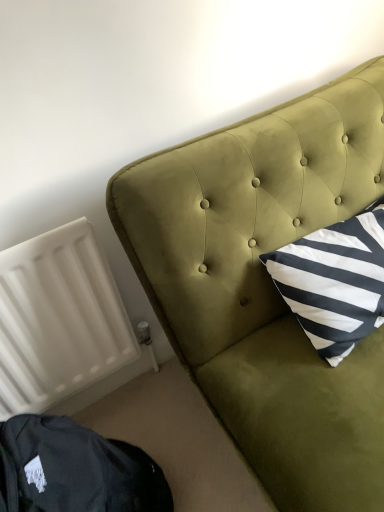
Question: Is dark green velvet bean bag chair at lower left taller than white matte radiator at lower left?

Choices:
 (A) yes
 (B) no

Answer: (B)

Question: Is white matte radiator at lower left surrounded by dark green velvet bean bag chair at lower left?

Choices:
 (A) no
 (B) yes

Answer: (A)

Question: Is dark green velvet bean bag chair at lower left at the right side of white matte radiator at lower left?

Choices:
 (A) no
 (B) yes

Answer: (B)

Question: From a real-world perspective, is dark green velvet bean bag chair at lower left on top of white matte radiator at lower left?

Choices:
 (A) yes
 (B) no

Answer: (B)

Question: From a real-world perspective, does dark green velvet bean bag chair at lower left sit lower than white matte radiator at lower left?

Choices:
 (A) no
 (B) yes

Answer: (B)

Question: Considering the positions of point pos(112,288) and point pos(29,461), is point pos(112,288) closer or farther from the camera than point pos(29,461)?

Choices:
 (A) closer
 (B) farther

Answer: (B)

Question: From a real-world perspective, is white matte radiator at lower left physically located above or below dark green velvet bean bag chair at lower left?

Choices:
 (A) below
 (B) above

Answer: (B)

Question: Considering their positions, is white matte radiator at lower left located in front of or behind dark green velvet bean bag chair at lower left?

Choices:
 (A) front
 (B) behind

Answer: (B)

Question: Is white matte radiator at lower left wider or thinner than dark green velvet bean bag chair at lower left?

Choices:
 (A) thin
 (B) wide

Answer: (A)

Question: Considering the positions of velvet green headboard at upper right and dark green velvet bean bag chair at lower left in the image, is velvet green headboard at upper right wider or thinner than dark green velvet bean bag chair at lower left?

Choices:
 (A) wide
 (B) thin

Answer: (A)

Question: Would you say velvet green headboard at upper right is inside or outside dark green velvet bean bag chair at lower left?

Choices:
 (A) inside
 (B) outside

Answer: (B)

Question: From a real-world perspective, is velvet green headboard at upper right positioned above or below dark green velvet bean bag chair at lower left?

Choices:
 (A) above
 (B) below

Answer: (A)

Question: From their relative heights in the image, would you say velvet green headboard at upper right is taller or shorter than dark green velvet bean bag chair at lower left?

Choices:
 (A) tall
 (B) short

Answer: (A)

Question: From the image's perspective, is velvet green headboard at upper right above or below white matte radiator at lower left?

Choices:
 (A) below
 (B) above

Answer: (B)

Question: Considering the positions of velvet green headboard at upper right and white matte radiator at lower left in the image, is velvet green headboard at upper right taller or shorter than white matte radiator at lower left?

Choices:
 (A) short
 (B) tall

Answer: (B)